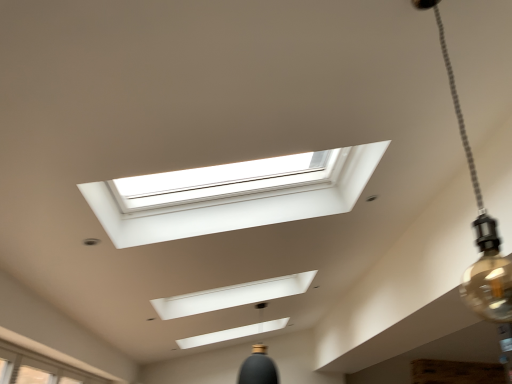
Question: From their relative heights in the image, would you say matte glass bulb at upper right is taller or shorter than white glass window at lower left?

Choices:
 (A) tall
 (B) short

Answer: (A)

Question: Is matte glass bulb at upper right wider or thinner than white glass window at lower left?

Choices:
 (A) wide
 (B) thin

Answer: (B)

Question: Would you say matte glass bulb at upper right is inside or outside white glass window at lower left?

Choices:
 (A) inside
 (B) outside

Answer: (B)

Question: From a real-world perspective, is white glass window at lower left positioned above or below matte glass bulb at upper right?

Choices:
 (A) above
 (B) below

Answer: (B)

Question: Considering the positions of white glass window at lower left and matte glass bulb at upper right in the image, is white glass window at lower left wider or thinner than matte glass bulb at upper right?

Choices:
 (A) thin
 (B) wide

Answer: (B)

Question: Would you say white glass window at lower left is to the left or to the right of matte glass bulb at upper right in the picture?

Choices:
 (A) right
 (B) left

Answer: (B)

Question: In terms of height, does white glass window at lower left look taller or shorter compared to matte glass bulb at upper right?

Choices:
 (A) short
 (B) tall

Answer: (A)